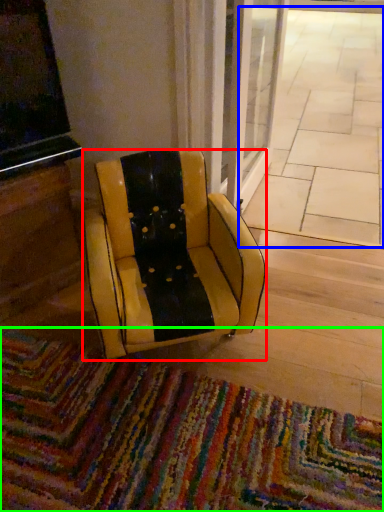
Question: Which is nearer to the chair (highlighted by a red box)? pavement (highlighted by a blue box) or mat (highlighted by a green box).

Choices:
 (A) pavement
 (B) mat

Answer: (B)